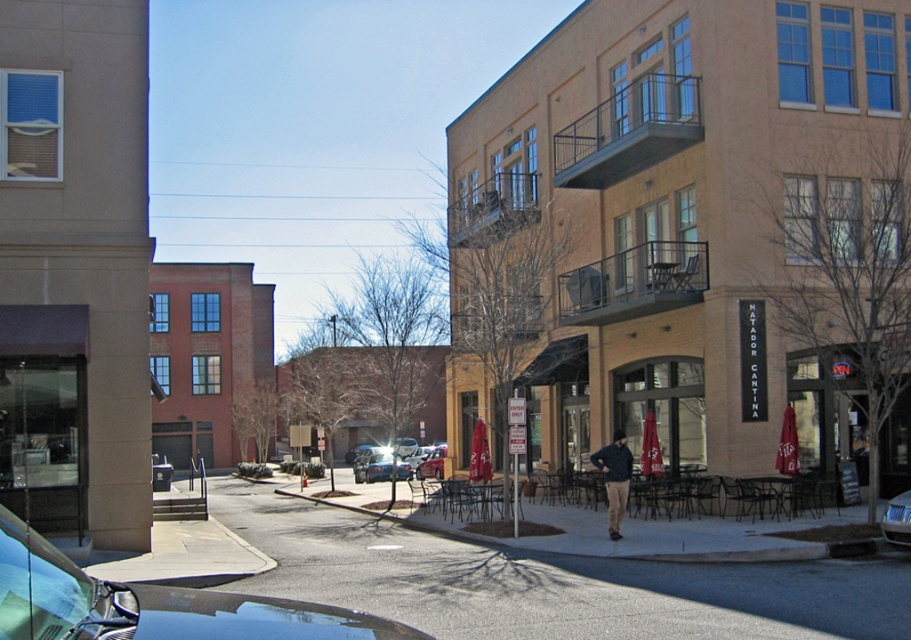
Can you confirm if metallic silver sedan at center is wider than metallic blue sedan at lower right?

Yes, metallic silver sedan at center is wider than metallic blue sedan at lower right.

Is metallic silver sedan at center to the left of metallic blue sedan at lower right from the viewer's perspective?

A: Correct, you'll find metallic silver sedan at center to the left of metallic blue sedan at lower right.

Locate an element on the screen. The width and height of the screenshot is (911, 640). metallic silver sedan at center is located at coordinates (380, 467).

What do you see at coordinates (549, 580) in the screenshot? This screenshot has height=640, width=911. I see `gray asphalt at center` at bounding box center [549, 580].

Does gray asphalt at center appear on the left side of metallic silver sedan at center?

In fact, gray asphalt at center is to the right of metallic silver sedan at center.

Is point (545, 589) more distant than point (375, 456)?

No.

Locate an element on the screen. The image size is (911, 640). gray asphalt at center is located at coordinates (549, 580).

Does point (362, 628) come closer to viewer compared to point (903, 504)?

Yes.

Between shiny blue car at lower left and metallic blue sedan at lower right, which one appears on the left side from the viewer's perspective?

Positioned to the left is shiny blue car at lower left.

At what (x,y) coordinates should I click in order to perform the action: click on shiny blue car at lower left. Please return your answer as a coordinate pair (x, y). Looking at the image, I should click on (151, 604).